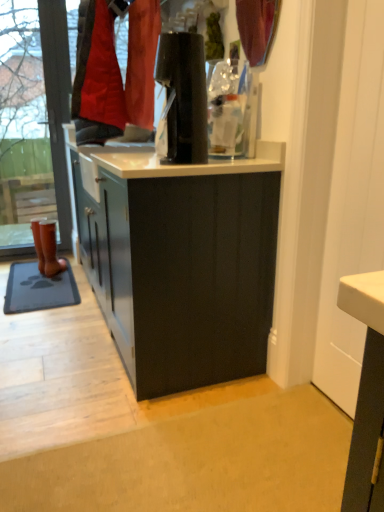
Question: Should I look upward or downward to see brown leather boot at left?

Choices:
 (A) down
 (B) up

Answer: (B)

Question: From the image's perspective, is transparent glass shop window at left below brown leather boot at left?

Choices:
 (A) yes
 (B) no

Answer: (B)

Question: Is transparent glass shop window at left located outside brown leather boot at left?

Choices:
 (A) no
 (B) yes

Answer: (B)

Question: Does transparent glass shop window at left come behind brown leather boot at left?

Choices:
 (A) yes
 (B) no

Answer: (B)

Question: Is transparent glass shop window at left at the left side of brown leather boot at left?

Choices:
 (A) no
 (B) yes

Answer: (B)

Question: Is transparent glass shop window at left oriented away from brown leather boot at left?

Choices:
 (A) yes
 (B) no

Answer: (B)

Question: Is transparent glass shop window at left shorter than brown leather boot at left?

Choices:
 (A) yes
 (B) no

Answer: (B)

Question: Is gray rubber mat at lower left to the left of brown leather boot at left from the viewer's perspective?

Choices:
 (A) yes
 (B) no

Answer: (A)

Question: From a real-world perspective, does gray rubber mat at lower left sit lower than brown leather boot at left?

Choices:
 (A) yes
 (B) no

Answer: (A)

Question: Would you say gray rubber mat at lower left contains brown leather boot at left?

Choices:
 (A) no
 (B) yes

Answer: (A)

Question: Is gray rubber mat at lower left closer to camera compared to brown leather boot at left?

Choices:
 (A) no
 (B) yes

Answer: (B)

Question: Considering the relative sizes of gray rubber mat at lower left and brown leather boot at left in the image provided, is gray rubber mat at lower left smaller than brown leather boot at left?

Choices:
 (A) no
 (B) yes

Answer: (A)

Question: From a real-world perspective, is gray rubber mat at lower left positioned over brown leather boot at left based on gravity?

Choices:
 (A) no
 (B) yes

Answer: (A)

Question: Can you confirm if gray rubber mat at lower left is thinner than matte red curtain at upper center?

Choices:
 (A) yes
 (B) no

Answer: (B)